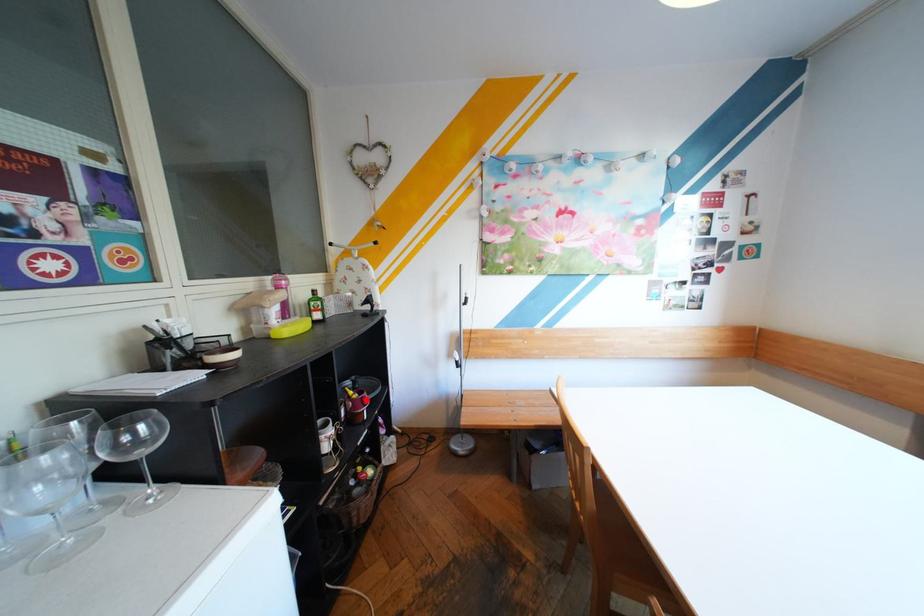
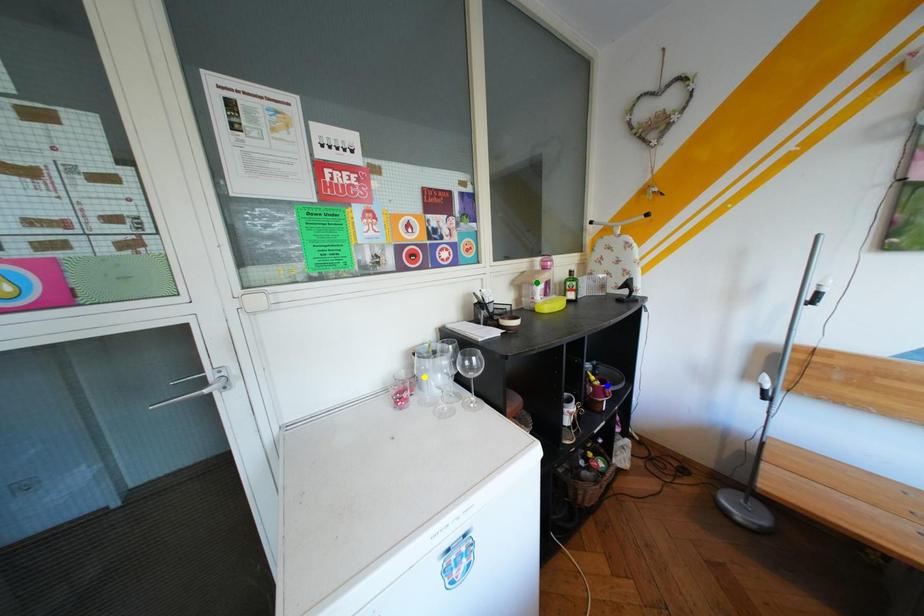
Question: I am providing you with two images of the same scene from different viewpoints. A red point is marked on the first image. You are given multiple points on the second image. Which mark in image 2 goes with the point in image 1?

Choices:
 (A) blue point
 (B) green point
 (C) yellow point

Answer: (A)